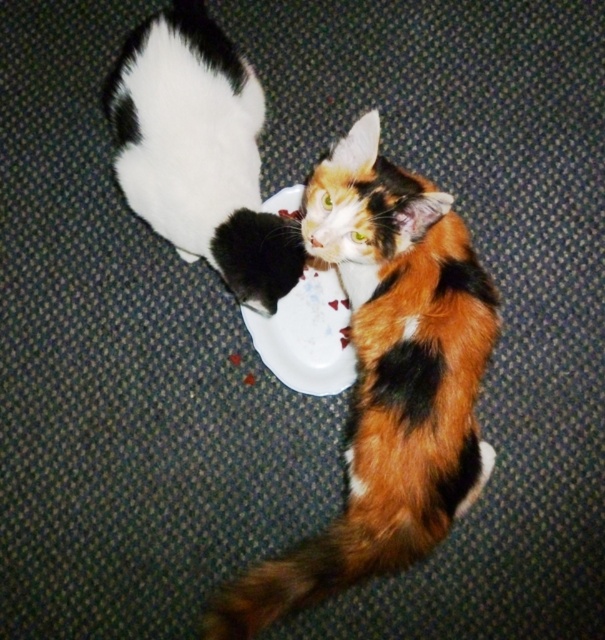
Does point (292, 598) lie behind point (183, 8)?

No, (292, 598) is in front of (183, 8).

Does point (348, 225) lie in front of point (223, 112)?

Yes.

Where is `calico fur cat at center`? calico fur cat at center is located at coordinates (387, 380).

Where is `calico fur cat at center`? calico fur cat at center is located at coordinates (387, 380).

Is point (476, 369) positioned behind point (336, 275)?

No, it is in front of (336, 275).

Is point (378, 344) farther from viewer compared to point (321, 394)?

No, (378, 344) is closer to viewer.

This screenshot has width=605, height=640. In order to click on calico fur cat at center in this screenshot , I will do `click(387, 380)`.

Who is positioned more to the left, white fluffy cat at upper left or white glossy plate at center?

white fluffy cat at upper left is more to the left.

Is point (229, 289) farther from camera compared to point (278, 314)?

No, (229, 289) is in front of (278, 314).

Locate an element on the screen. The width and height of the screenshot is (605, 640). white fluffy cat at upper left is located at coordinates (198, 150).